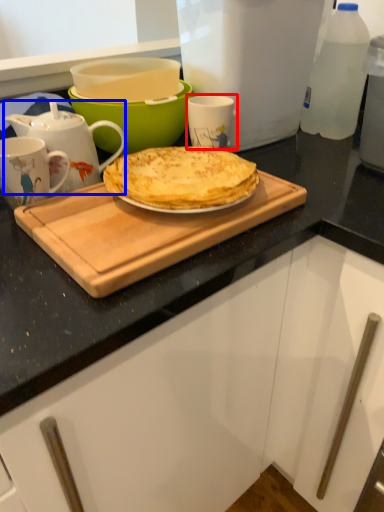
Question: Which point is closer to the camera, coffee cup (highlighted by a red box) or teapot (highlighted by a blue box)?

Choices:
 (A) coffee cup
 (B) teapot

Answer: (B)